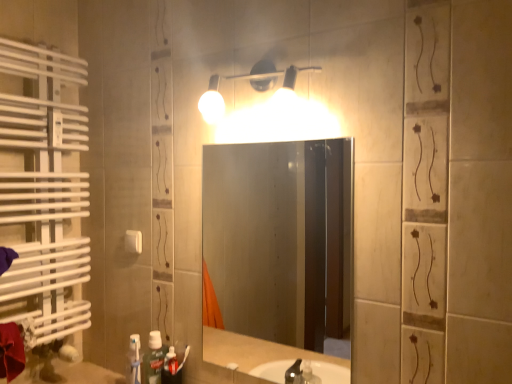
The height and width of the screenshot is (384, 512). What do you see at coordinates (251, 80) in the screenshot?
I see `matte white light fixture at upper center` at bounding box center [251, 80].

Measure the distance between point (166, 349) and camera.

Point (166, 349) and camera are 1.43 meters apart from each other.

In order to face green matte toothpaste at lower left, should I rotate leftwards or rightwards?

It's best to rotate left around 12.716 degrees.

Find the location of a particular element. This screenshot has height=384, width=512. matte white light fixture at upper center is located at coordinates [251, 80].

Based on the photo, from a real-world perspective, relative to white plastic light switch at upper center, is smooth glass mirror at center vertically above or below?

smooth glass mirror at center is situated lower than white plastic light switch at upper center in the real world.

Which object is thinner, smooth glass mirror at center or white plastic light switch at upper center?

With smaller width is white plastic light switch at upper center.

From the image's perspective, is smooth glass mirror at center positioned above or below white plastic light switch at upper center?

From the image's perspective, smooth glass mirror at center appears below white plastic light switch at upper center.

Is point (339, 176) positioned before point (125, 241)?

No, (339, 176) is further to viewer.

Considering the positions of objects white plastic light switch at upper center and matte white light fixture at upper center in the image provided, who is behind, white plastic light switch at upper center or matte white light fixture at upper center?

white plastic light switch at upper center is further away from the camera.

From a real-world perspective, which is physically below, white plastic light switch at upper center or matte white light fixture at upper center?

In real-world perspective, white plastic light switch at upper center is lower.

I want to click on light switch on the left of the matte white light fixture at upper center, so click(133, 241).

Is white plastic light switch at upper center outside of matte white light fixture at upper center?

Indeed, white plastic light switch at upper center is completely outside matte white light fixture at upper center.

Is smooth glass mirror at center looking in the opposite direction of green matte toothpaste at lower left?

No, smooth glass mirror at center is not facing away from green matte toothpaste at lower left.

In the scene shown: Which of these two, smooth glass mirror at center or green matte toothpaste at lower left, is smaller?

green matte toothpaste at lower left.

From a real-world perspective, is smooth glass mirror at center physically located above or below green matte toothpaste at lower left?

smooth glass mirror at center is above green matte toothpaste at lower left.

Is white plastic light switch at upper center completely or partially inside matte white light fixture at upper center?

Definitely not — white plastic light switch at upper center is not inside matte white light fixture at upper center.

From the image's perspective, does matte white light fixture at upper center appear lower than white plastic light switch at upper center?

No.

Does point (222, 77) come in front of point (136, 234)?

Yes, point (222, 77) is in front of point (136, 234).

Is matte white light fixture at upper center facing away from white plastic light switch at upper center?

No, white plastic light switch at upper center is not at the back of matte white light fixture at upper center.

Is matte white light fixture at upper center bigger or smaller than green matte toothpaste at lower left?

In the image, matte white light fixture at upper center appears to be larger than green matte toothpaste at lower left.

Is matte white light fixture at upper center beside green matte toothpaste at lower left?

No, matte white light fixture at upper center is not touching green matte toothpaste at lower left.

Is matte white light fixture at upper center facing away from green matte toothpaste at lower left?

No, matte white light fixture at upper center is not facing away from green matte toothpaste at lower left.

Is point (209, 98) farther from camera compared to point (269, 205)?

No, it is not.

Is matte white light fixture at upper center completely or partially outside of smooth glass mirror at center?

That's correct, matte white light fixture at upper center is outside of smooth glass mirror at center.

From a real-world perspective, is matte white light fixture at upper center above or below smooth glass mirror at center?

From a real-world perspective, matte white light fixture at upper center is physically above smooth glass mirror at center.

In order to click on light fixture above the smooth glass mirror at center (from the image's perspective) in this screenshot , I will do `click(251, 80)`.

From a real-world perspective, who is located higher, green matte toothpaste at lower left or white plastic light switch at upper center?

From a 3D spatial view, white plastic light switch at upper center is above.

Is green matte toothpaste at lower left aimed at white plastic light switch at upper center?

No, green matte toothpaste at lower left is not turned towards white plastic light switch at upper center.

Consider the image. Is green matte toothpaste at lower left positioned beyond the bounds of white plastic light switch at upper center?

Yes.

The width and height of the screenshot is (512, 384). What are the coordinates of `mirror that is under the white plastic light switch at upper center (from a real-world perspective)` in the screenshot? It's located at (279, 239).

Where is `light fixture that appears in front of the white plastic light switch at upper center`? The image size is (512, 384). light fixture that appears in front of the white plastic light switch at upper center is located at coordinates (251, 80).

When comparing their distances from white plastic light switch at upper center, does green matte toothpaste at lower left or smooth glass mirror at center seem closer?

green matte toothpaste at lower left is closer to white plastic light switch at upper center.

Looking at the image, which one is located further to matte white light fixture at upper center, white plastic light switch at upper center or green matte toothpaste at lower left?

Based on the image, green matte toothpaste at lower left appears to be further to matte white light fixture at upper center.

Based on their spatial positions, is matte white light fixture at upper center or smooth glass mirror at center closer to white plastic light switch at upper center?

matte white light fixture at upper center lies closer to white plastic light switch at upper center than the other object.

Which object lies nearer to the anchor point smooth glass mirror at center, white plastic light switch at upper center or green matte toothpaste at lower left?

Among the two, white plastic light switch at upper center is located nearer to smooth glass mirror at center.

When comparing their distances from green matte toothpaste at lower left, does smooth glass mirror at center or matte white light fixture at upper center seem closer?

Based on the image, matte white light fixture at upper center appears to be nearer to green matte toothpaste at lower left.

Considering their positions, is smooth glass mirror at center positioned further to matte white light fixture at upper center than green matte toothpaste at lower left?

Among the two, smooth glass mirror at center is located further to matte white light fixture at upper center.

When comparing their distances from smooth glass mirror at center, does matte white light fixture at upper center or white plastic light switch at upper center seem further?

Among the two, matte white light fixture at upper center is located further to smooth glass mirror at center.

From the image, which object appears to be nearer to white plastic light switch at upper center, smooth glass mirror at center or green matte toothpaste at lower left?

green matte toothpaste at lower left lies closer to white plastic light switch at upper center than the other object.

This screenshot has width=512, height=384. Identify the location of mirror between matte white light fixture at upper center and green matte toothpaste at lower left from top to bottom. (279, 239).

Find the location of a particular element. bottle situated between white plastic light switch at upper center and smooth glass mirror at center from left to right is located at coordinates (153, 359).

Locate an element on the screen. light switch between matte white light fixture at upper center and green matte toothpaste at lower left in the up-down direction is located at coordinates (133, 241).

Locate an element on the screen. Image resolution: width=512 pixels, height=384 pixels. mirror located between matte white light fixture at upper center and white plastic light switch at upper center in the depth direction is located at coordinates coord(279,239).